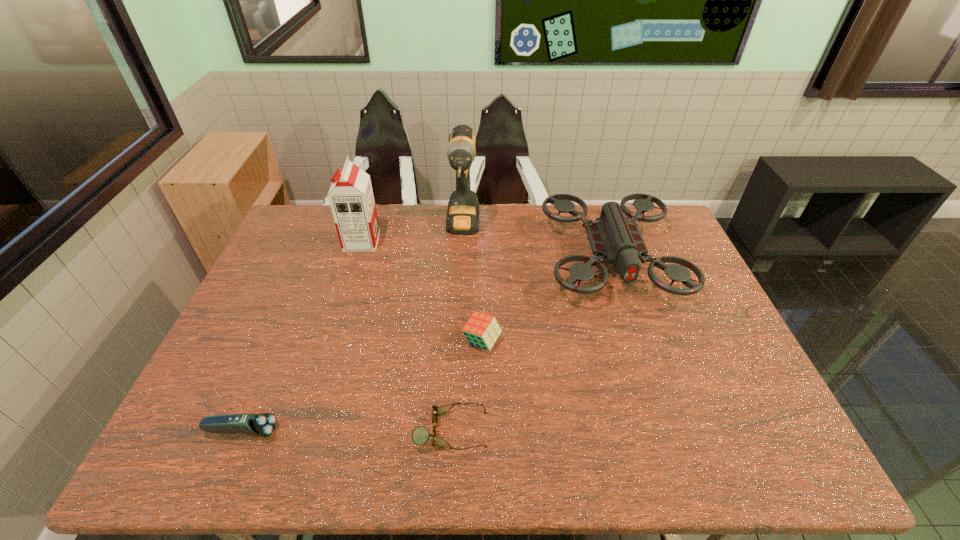
The height and width of the screenshot is (540, 960). I want to click on free location that satisfies the following two spatial constraints: 1. with the drill bit of the drill facing forward; 2. on the front-facing side of the spectacles, so click(x=453, y=430).

I want to click on vacant position in the image that satisfies the following two spatial constraints: 1. with the drill bit of the drill facing forward; 2. on the front-facing side of the spectacles, so point(453,430).

At what (x,y) coordinates should I click in order to perform the action: click on vacant region that satisfies the following two spatial constraints: 1. with the drill bit of the drill facing forward; 2. on the head of the electric shaver. Please return your answer as a coordinate pair (x, y). This screenshot has width=960, height=540. Looking at the image, I should click on (453, 431).

This screenshot has height=540, width=960. Find the location of `free spot that satisfies the following two spatial constraints: 1. with the drill bit of the drill facing forward; 2. on the head of the electric shaver`. free spot that satisfies the following two spatial constraints: 1. with the drill bit of the drill facing forward; 2. on the head of the electric shaver is located at coordinates [x=453, y=431].

Locate an element on the screen. vacant space that satisfies the following two spatial constraints: 1. with the drill bit of the drill facing forward; 2. on the left side of the cube is located at coordinates pos(458,342).

Locate an element on the screen. This screenshot has width=960, height=540. free space that satisfies the following two spatial constraints: 1. on the front-facing side of the drone; 2. on the head of the electric shaver is located at coordinates (667, 431).

The image size is (960, 540). Find the location of `vacant area that satisfies the following two spatial constraints: 1. with the drill bit of the cube facing forward; 2. on the right side of the drill`. vacant area that satisfies the following two spatial constraints: 1. with the drill bit of the cube facing forward; 2. on the right side of the drill is located at coordinates click(x=458, y=342).